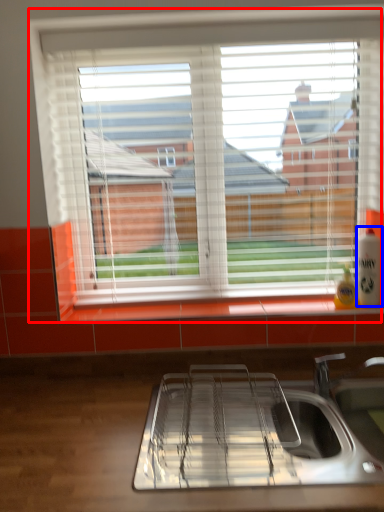
Question: Which of the following is the farthest to the observer, window (highlighted by a red box) or beverage (highlighted by a blue box)?

Choices:
 (A) window
 (B) beverage

Answer: (B)